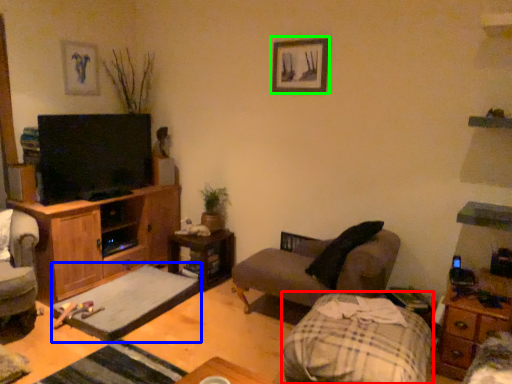
Question: Considering the real-world distances, which object is closest to flat (highlighted by a red box)? footrest (highlighted by a blue box) or picture frame (highlighted by a green box).

Choices:
 (A) footrest
 (B) picture frame

Answer: (A)